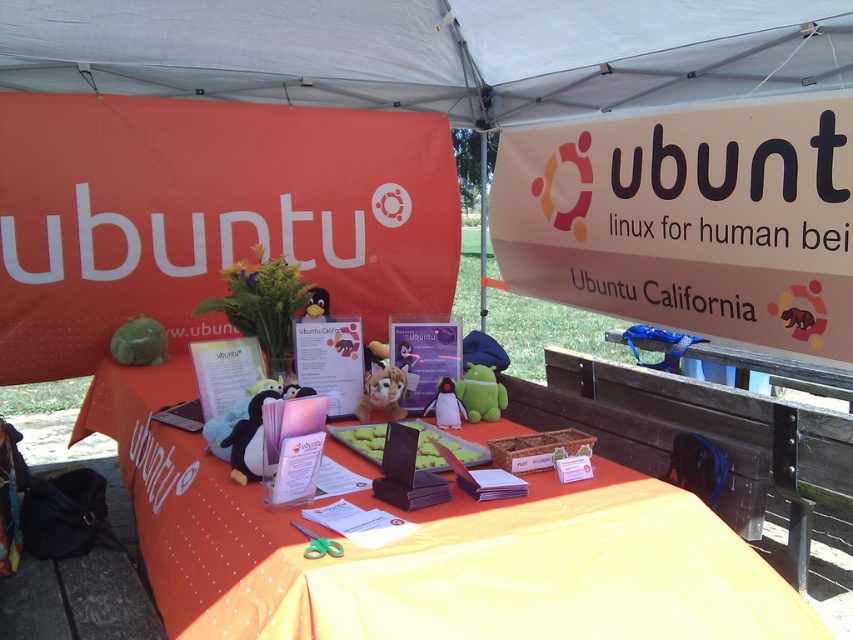
Question: Is orange fabric table at center positioned at the back of fuzzy fabric stuffed animal at center?

Choices:
 (A) yes
 (B) no

Answer: (B)

Question: Which point is closer to the camera?

Choices:
 (A) (485, 49)
 (B) (364, 385)
 (C) (437, 420)
 (D) (592, 138)

Answer: (C)

Question: Which object is farther from the camera taking this photo?

Choices:
 (A) matte plastic penguin at center
 (B) white paper sign at upper right
 (C) fuzzy fabric stuffed animal at center

Answer: (B)

Question: Which point is farther to the camera?

Choices:
 (A) orange fabric table at center
 (B) white paper sign at upper right
 (C) white fabric canopy at upper center

Answer: (B)

Question: Is green plush toy at center bigger than fuzzy fabric stuffed animal at center?

Choices:
 (A) no
 (B) yes

Answer: (B)

Question: Can you confirm if orange fabric table at center is wider than matte plastic penguin at center?

Choices:
 (A) no
 (B) yes

Answer: (B)